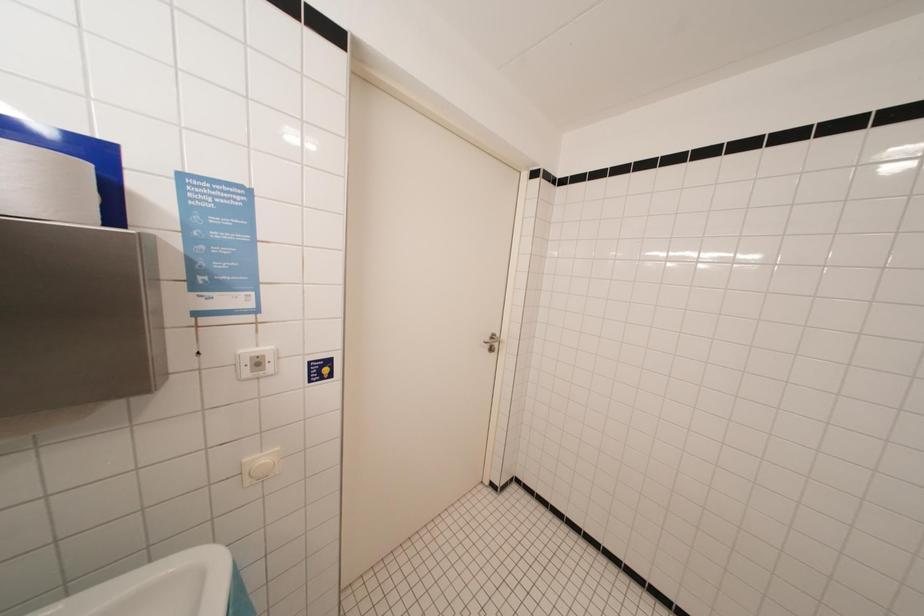
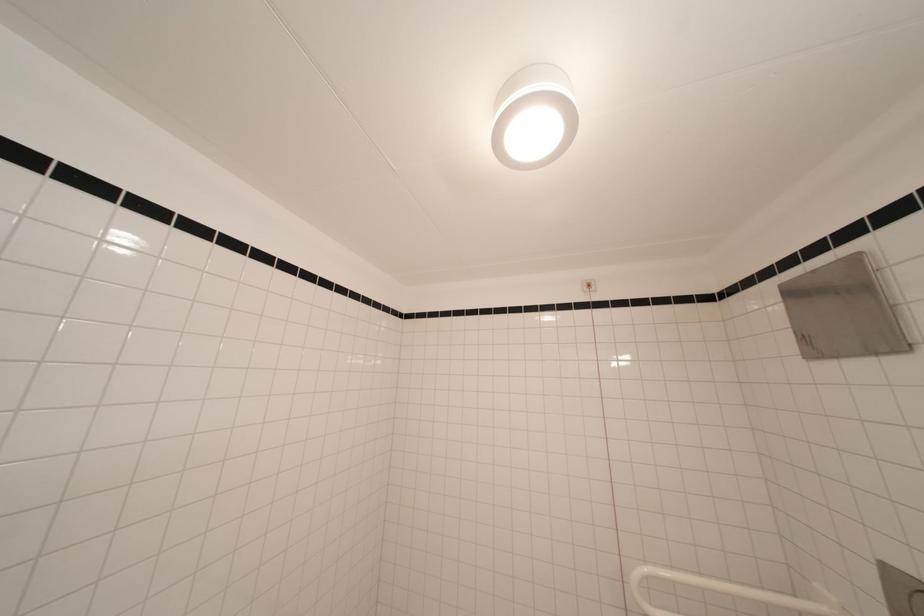
Question: The camera is either moving clockwise (left) or counter-clockwise (right) around the object. The first image is from the beginning of the video and the second image is from the end. Is the camera moving left or right when shooting the video?

Choices:
 (A) Left
 (B) Right

Answer: (A)